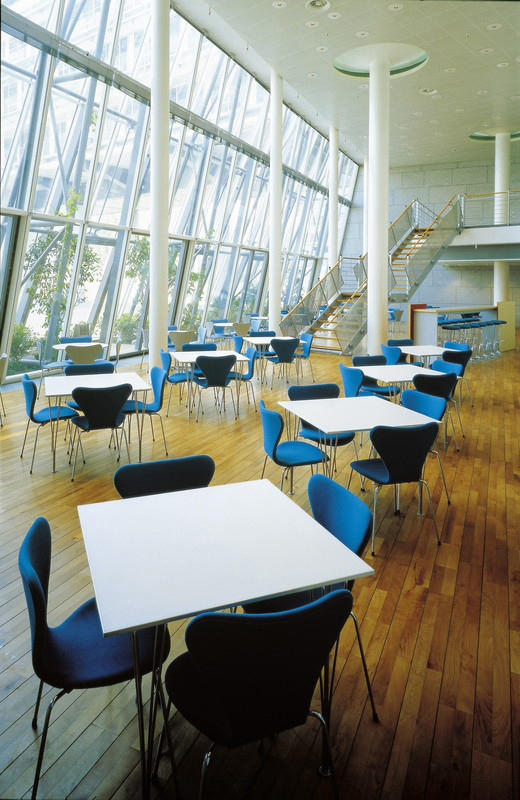
Where is `pillars`? This screenshot has height=800, width=520. pillars is located at coordinates (156, 146), (279, 149), (333, 154), (378, 157), (365, 190), (498, 172).